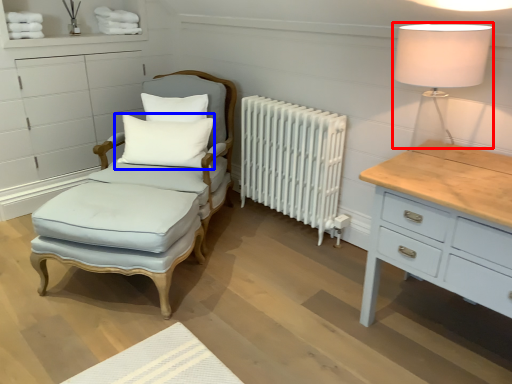
Question: Which point is further to the camera, table lamp (highlighted by a red box) or pillow (highlighted by a blue box)?

Choices:
 (A) table lamp
 (B) pillow

Answer: (B)